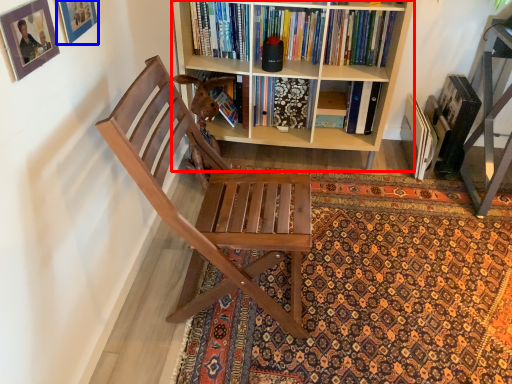
Question: Which object appears farthest to the camera in this image, bookcase (highlighted by a red box) or picture frame (highlighted by a blue box)?

Choices:
 (A) bookcase
 (B) picture frame

Answer: (A)